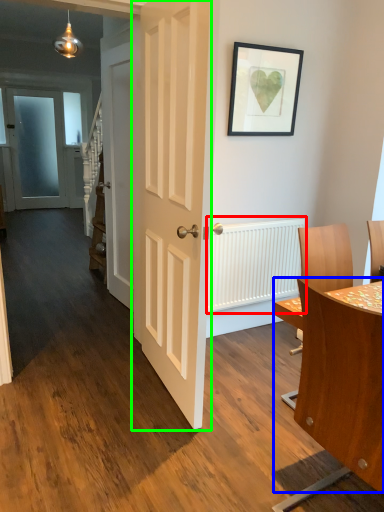
Question: Which object is positioned farthest from radiator (highlighted by a red box)? Select from table (highlighted by a blue box) and door (highlighted by a green box).

Choices:
 (A) table
 (B) door

Answer: (A)